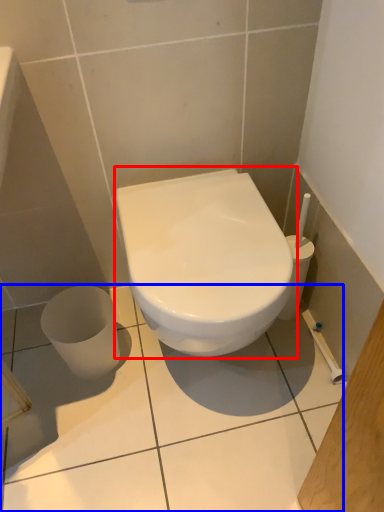
Question: Which object appears farthest to the camera in this image, toilet (highlighted by a red box) or ceramic tile (highlighted by a blue box)?

Choices:
 (A) toilet
 (B) ceramic tile

Answer: (B)